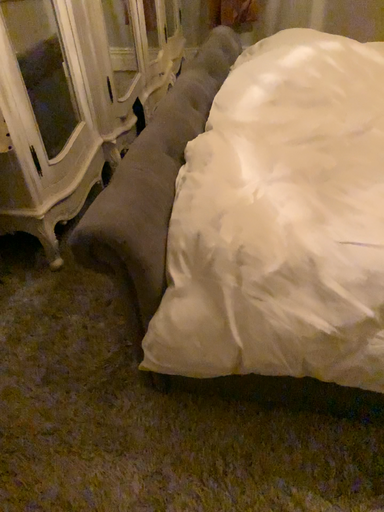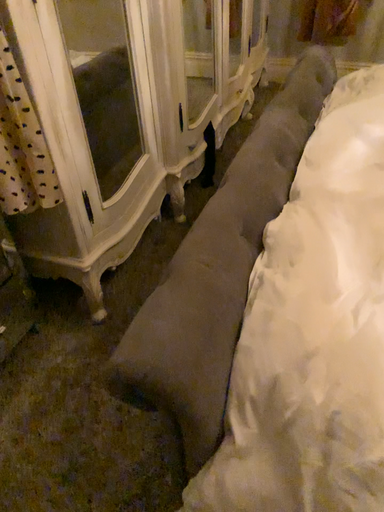
Question: Which way did the camera rotate in the video?

Choices:
 (A) rotated left
 (B) rotated right

Answer: (A)